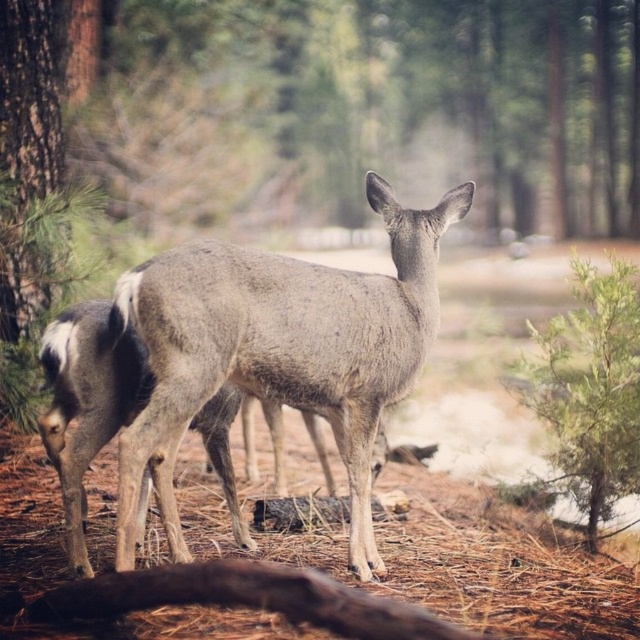
You are standing in the forest and see two points marked in the scene. Which point is closer to you? The points are labeled as point [272,310] and point [250,593].

Point [272,310] is closer to you because it is further to the camera than point [250,593].